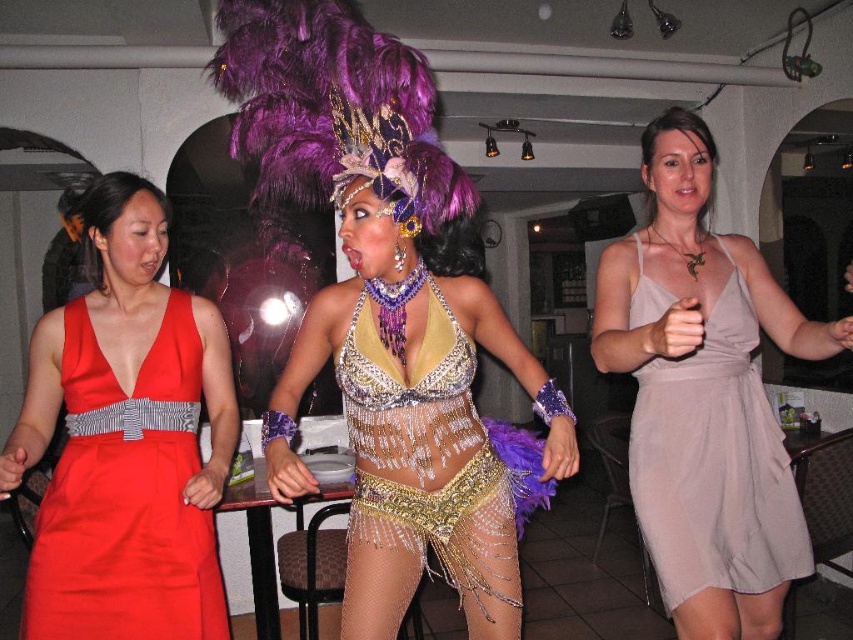
Question: Which object is closer to the camera taking this photo?

Choices:
 (A) matte beige dress at center
 (B) shiny metallic belly dancer costume at center
 (C) satin red dress at left

Answer: (A)

Question: Which object is closer to the camera taking this photo?

Choices:
 (A) matte beige dress at center
 (B) shiny metallic belly dancer costume at center
 (C) satin red dress at left
 (D) shiny metallic costume at center

Answer: (A)

Question: Does satin red dress at left have a lesser width compared to shiny metallic belly dancer costume at center?

Choices:
 (A) no
 (B) yes

Answer: (A)

Question: Based on their relative distances, which object is farther from the shiny metallic belly dancer costume at center?

Choices:
 (A) satin red dress at left
 (B) matte beige dress at center

Answer: (A)

Question: Does matte beige dress at center have a lesser width compared to satin red dress at left?

Choices:
 (A) no
 (B) yes

Answer: (A)

Question: In this image, where is shiny metallic costume at center located relative to matte beige dress at center?

Choices:
 (A) right
 (B) left

Answer: (B)